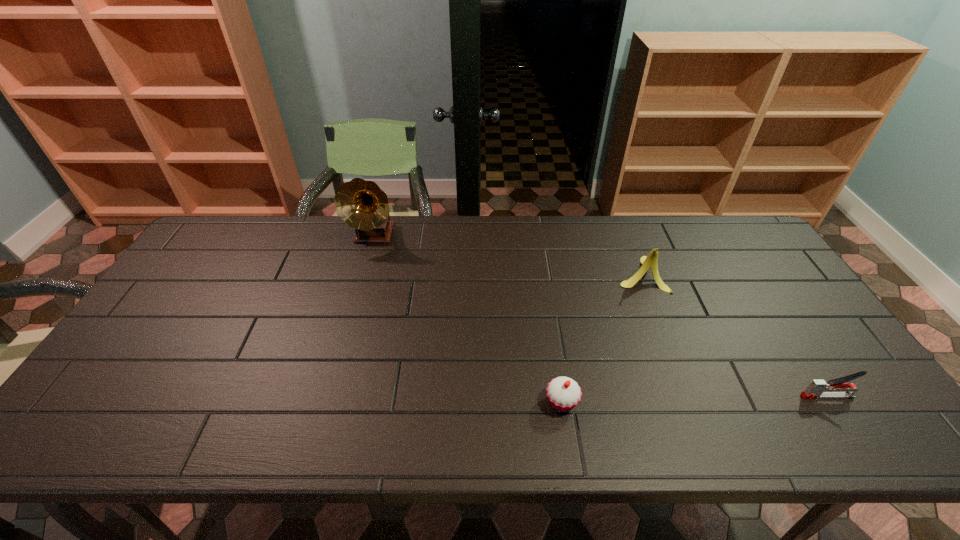
The height and width of the screenshot is (540, 960). I want to click on the farthest object, so click(363, 206).

Identify the location of the tallest object. The width and height of the screenshot is (960, 540). (363, 206).

Where is `the second object from right to left`? the second object from right to left is located at coordinates (651, 261).

The width and height of the screenshot is (960, 540). I want to click on the third nearest object, so click(x=651, y=261).

The width and height of the screenshot is (960, 540). What are the coordinates of `stapler` in the screenshot? It's located at (817, 388).

At what (x,y) coordinates should I click in order to perform the action: click on the rightmost object. Please return your answer as a coordinate pair (x, y). This screenshot has width=960, height=540. Looking at the image, I should click on (817, 388).

This screenshot has width=960, height=540. Find the location of `the shortest object`. the shortest object is located at coordinates [x=563, y=393].

The width and height of the screenshot is (960, 540). What are the coordinates of `cupcake` in the screenshot? It's located at (563, 393).

Locate an element on the screen. The width and height of the screenshot is (960, 540). free space located 0.340m on the horn of the phonograph_record is located at coordinates click(x=347, y=332).

Locate an element on the screen. Image resolution: width=960 pixels, height=540 pixels. free space located on the front of the second tallest object is located at coordinates (669, 346).